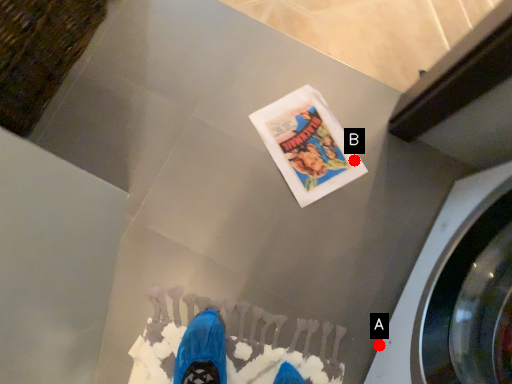
Question: Two points are circled on the image, labeled by A and B beside each circle. Which point is closer to the camera?

Choices:
 (A) A is closer
 (B) B is closer

Answer: (A)